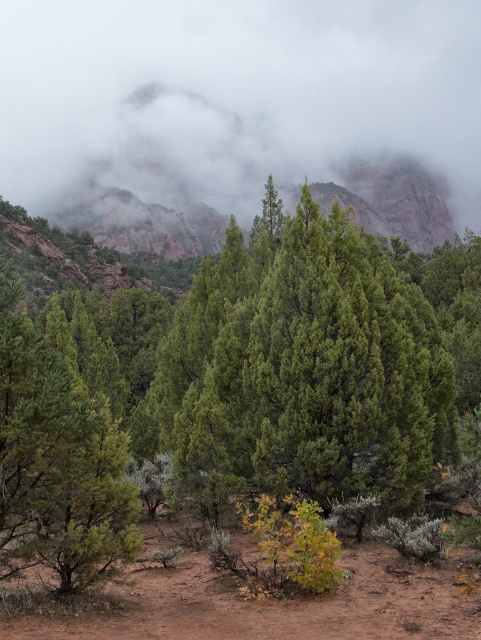
You are standing in the mountain landscape and want to place a small flag at each of the two points labeled point (74,310) and point (115,502). Which point is closer to you so that you can reach it first without moving?

Point (74,310) is closer to you because it is further to the camera than point (115,502), meaning it requires less distance to reach.